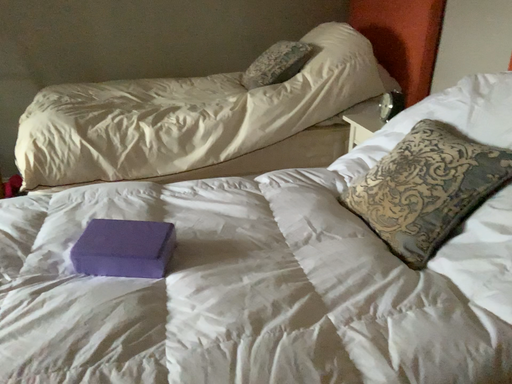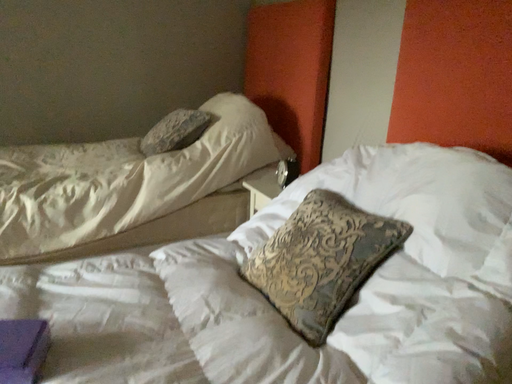
Question: Which way did the camera rotate in the video?

Choices:
 (A) rotated right
 (B) rotated left

Answer: (A)